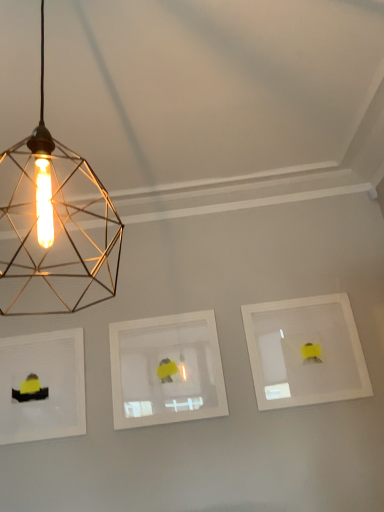
Question: Does point (46, 271) appear closer or farther from the camera than point (41, 376)?

Choices:
 (A) closer
 (B) farther

Answer: (A)

Question: Is gold wire mesh light bulb at upper left situated inside matte white picture frame at left, which ranks as the 3th picture frame in right-to-left order, or outside?

Choices:
 (A) inside
 (B) outside

Answer: (B)

Question: Estimate the real-world distances between objects in this image. Which object is farther from the matte white picture frame at left, which ranks as the 3th picture frame in right-to-left order?

Choices:
 (A) gold wire mesh light bulb at upper left
 (B) white matte picture frame at right, positioned as the 3th picture frame in left-to-right order
 (C) white matte picture frame at center, the second picture frame in the right-to-left sequence

Answer: (B)

Question: Which object is positioned closest to the white matte picture frame at right, acting as the first picture frame starting from the right?

Choices:
 (A) gold wire mesh light bulb at upper left
 (B) matte white picture frame at left, which ranks as the 3th picture frame in right-to-left order
 (C) white matte picture frame at center, the second picture frame in the right-to-left sequence

Answer: (C)